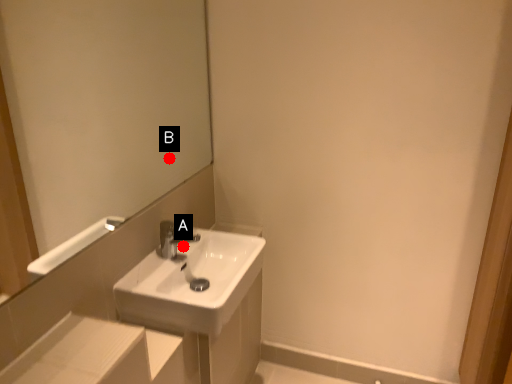
Question: Two points are circled on the image, labeled by A and B beside each circle. Which point appears farthest from the camera in this image?

Choices:
 (A) A is further
 (B) B is further

Answer: (B)